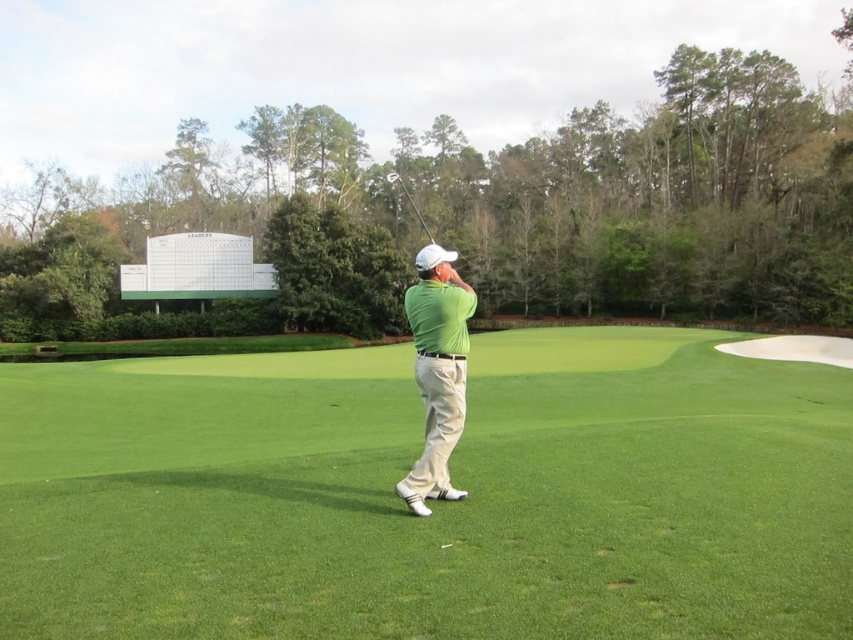
Question: Which object is farther from the camera taking this photo?

Choices:
 (A) green matte shirt at center
 (B) metallic silver golf club at center

Answer: (B)

Question: Among these points, which one is farthest from the camera?

Choices:
 (A) (219, 556)
 (B) (422, 225)
 (C) (426, 397)

Answer: (B)

Question: Does green matte shirt at center come behind metallic silver golf club at center?

Choices:
 (A) yes
 (B) no

Answer: (B)

Question: Does green matte shirt at center appear on the left side of metallic silver golf club at center?

Choices:
 (A) no
 (B) yes

Answer: (A)

Question: Is green matte shirt at center to the right of metallic silver golf club at center from the viewer's perspective?

Choices:
 (A) no
 (B) yes

Answer: (B)

Question: Considering the real-world distances, which object is closest to the metallic silver golf club at center?

Choices:
 (A) green matte shirt at center
 (B) green grass at center

Answer: (B)